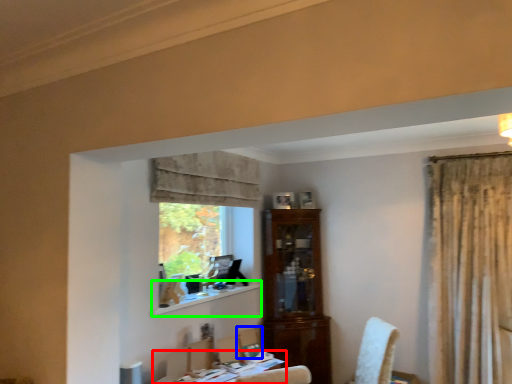
Question: Which object is positioned closest to table (highlighted by a red box)? Select from chair (highlighted by a blue box) and window sill (highlighted by a green box).

Choices:
 (A) chair
 (B) window sill

Answer: (A)